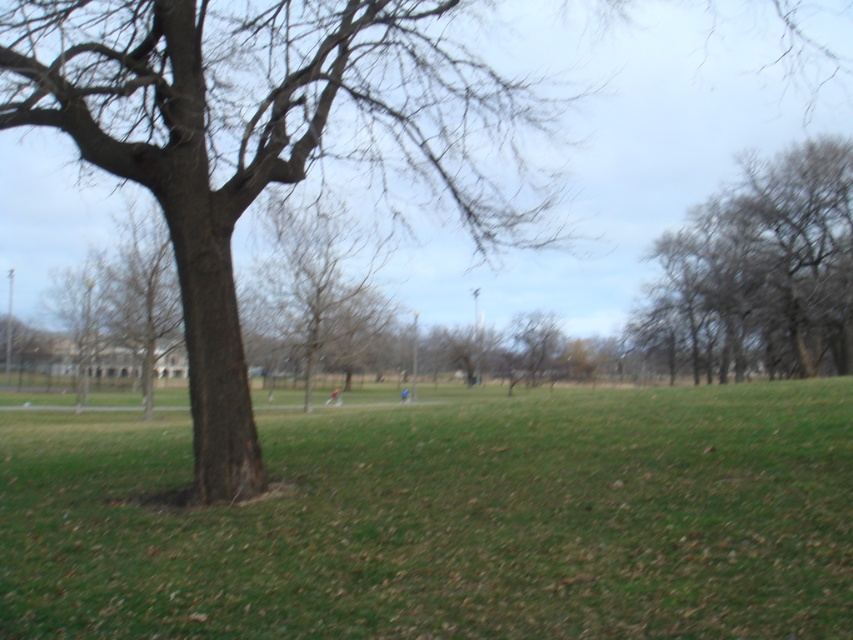
Question: Which point is closer to the camera?

Choices:
 (A) (291, 211)
 (B) (194, 294)
 (C) (49, 540)
 (D) (781, 212)

Answer: (C)

Question: Which point appears closest to the camera in this image?

Choices:
 (A) (318, 262)
 (B) (674, 273)
 (C) (315, 125)

Answer: (C)

Question: Among these points, which one is farthest from the camera?

Choices:
 (A) (236, 465)
 (B) (380, 330)

Answer: (B)

Question: Is brown rough bark tree at left smaller than bare wood tree at center?

Choices:
 (A) no
 (B) yes

Answer: (A)

Question: Is green grassy field at center behind gray textured tree at upper right?

Choices:
 (A) yes
 (B) no

Answer: (B)

Question: Does gray textured tree at upper right have a lesser width compared to bare wood tree at center?

Choices:
 (A) yes
 (B) no

Answer: (B)